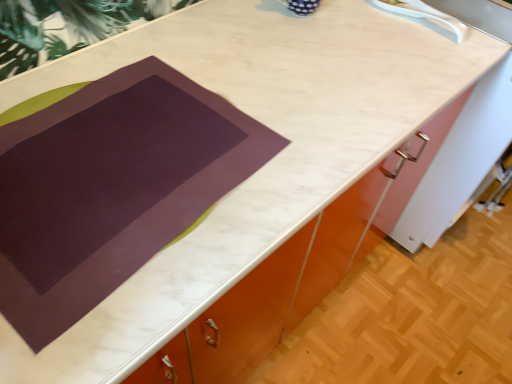
Where is `vacant space situated above purple matte placemat at center (from a real-world perspective)`? The height and width of the screenshot is (384, 512). vacant space situated above purple matte placemat at center (from a real-world perspective) is located at coordinates (117, 156).